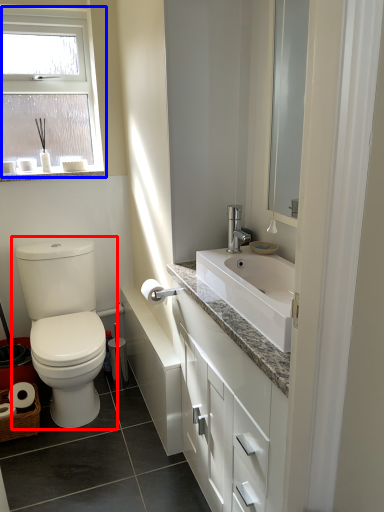
Question: Which of the following is the closest to the observer, toilet (highlighted by a red box) or window (highlighted by a blue box)?

Choices:
 (A) toilet
 (B) window

Answer: (A)